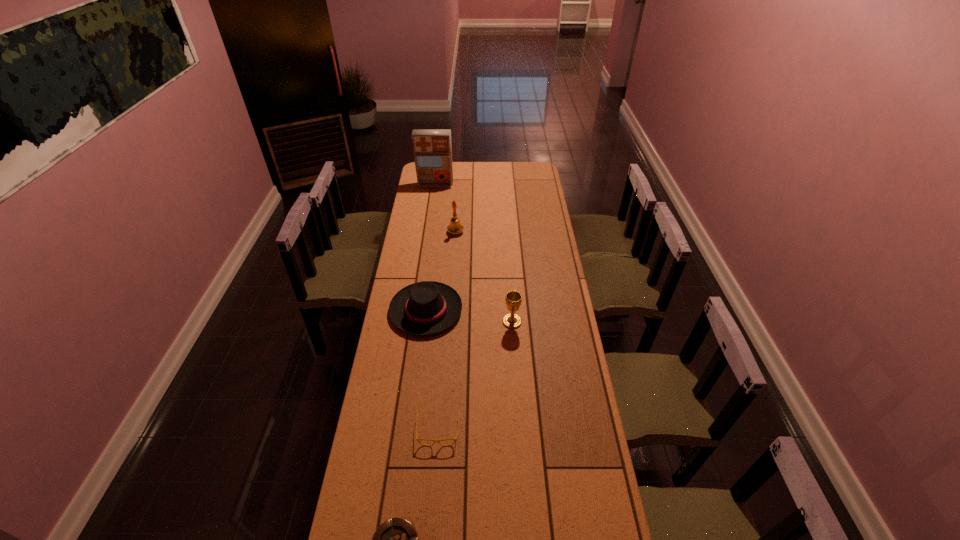
The height and width of the screenshot is (540, 960). What are the coordinates of `the farthest object` in the screenshot? It's located at (432, 148).

The width and height of the screenshot is (960, 540). In order to click on the first-aid kit in this screenshot , I will do `click(432, 148)`.

Find the location of `the second tallest object`. the second tallest object is located at coordinates 455,227.

Locate an element on the screen. The height and width of the screenshot is (540, 960). the fifth nearest object is located at coordinates (455, 227).

The image size is (960, 540). What are the coordinates of `chalice` in the screenshot? It's located at (513, 299).

Identify the location of the fourth shortest object. Image resolution: width=960 pixels, height=540 pixels. (513, 299).

Where is `dress hat`? This screenshot has height=540, width=960. dress hat is located at coordinates (424, 308).

The image size is (960, 540). What are the coordinates of `spectacles` in the screenshot? It's located at (434, 441).

Identify the location of the fifth tallest object. (434, 441).

Identify the location of free space located 0.350m on the front-facing side of the farthest object. The image size is (960, 540). (430, 222).